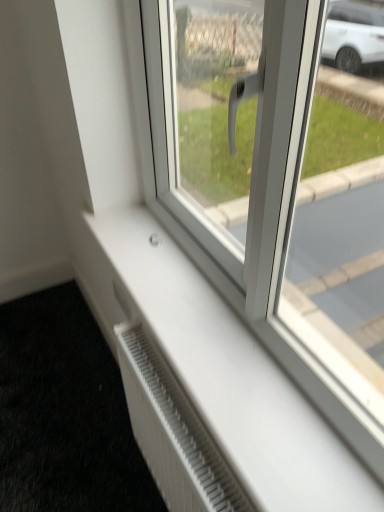
Question: Can you confirm if white plastic radiator at lower center is taller than white textured radiator at lower left?

Choices:
 (A) yes
 (B) no

Answer: (A)

Question: From a real-world perspective, is white plastic radiator at lower center below white textured radiator at lower left?

Choices:
 (A) yes
 (B) no

Answer: (B)

Question: Could you tell me if white plastic radiator at lower center is facing white textured radiator at lower left?

Choices:
 (A) no
 (B) yes

Answer: (A)

Question: Are white plastic radiator at lower center and white textured radiator at lower left beside each other?

Choices:
 (A) yes
 (B) no

Answer: (B)

Question: Is white plastic radiator at lower center turned away from white textured radiator at lower left?

Choices:
 (A) yes
 (B) no

Answer: (B)

Question: Would you say white plastic radiator at lower center is inside or outside white plastic window at center?

Choices:
 (A) inside
 (B) outside

Answer: (B)

Question: Does point (223, 473) appear closer or farther from the camera than point (377, 333)?

Choices:
 (A) farther
 (B) closer

Answer: (B)

Question: Based on their positions, is white plastic radiator at lower center located to the left or right of white plastic window at center?

Choices:
 (A) right
 (B) left

Answer: (B)

Question: In the image, is white plastic radiator at lower center positioned in front of or behind white plastic window at center?

Choices:
 (A) front
 (B) behind

Answer: (B)

Question: Considering the relative positions of white textured radiator at lower left and white plastic radiator at lower center in the image provided, is white textured radiator at lower left to the left or to the right of white plastic radiator at lower center?

Choices:
 (A) right
 (B) left

Answer: (B)

Question: From the image's perspective, is white textured radiator at lower left located above or below white plastic radiator at lower center?

Choices:
 (A) below
 (B) above

Answer: (A)

Question: In terms of width, does white textured radiator at lower left look wider or thinner when compared to white plastic radiator at lower center?

Choices:
 (A) wide
 (B) thin

Answer: (A)

Question: Is white textured radiator at lower left inside the boundaries of white plastic radiator at lower center, or outside?

Choices:
 (A) outside
 (B) inside

Answer: (A)

Question: From the image's perspective, relative to white textured radiator at lower left, is white plastic window at center above or below?

Choices:
 (A) above
 (B) below

Answer: (A)

Question: In the image, is white plastic window at center positioned in front of or behind white textured radiator at lower left?

Choices:
 (A) front
 (B) behind

Answer: (A)